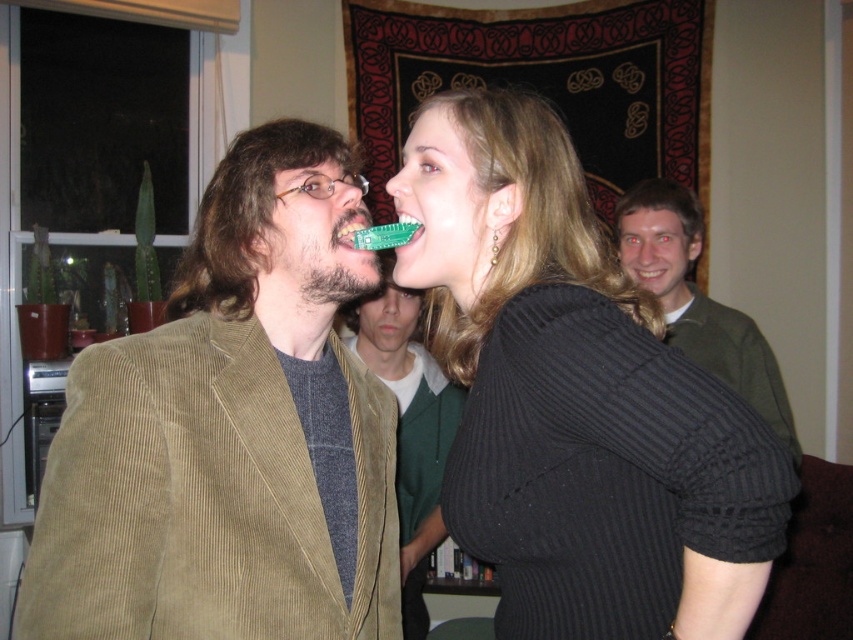
Question: Is beige corduroy blazer at left to the left of green corduroy jacket at center from the viewer's perspective?

Choices:
 (A) no
 (B) yes

Answer: (B)

Question: Which point is closer to the camera?

Choices:
 (A) black ribbed sweater at center
 (B) beige corduroy blazer at left
 (C) green corduroy jacket at upper right

Answer: (A)

Question: Is green corduroy jacket at upper right closer to the viewer compared to green circuit board at center?

Choices:
 (A) no
 (B) yes

Answer: (A)

Question: Does black ribbed sweater at center appear over green circuit board at center?

Choices:
 (A) no
 (B) yes

Answer: (A)

Question: Which object appears closest to the camera in this image?

Choices:
 (A) beige corduroy blazer at left
 (B) green corduroy jacket at upper right
 (C) black ribbed sweater at center

Answer: (C)

Question: Which of the following is the closest to the observer?

Choices:
 (A) green corduroy jacket at center
 (B) black ribbed sweater at center

Answer: (B)